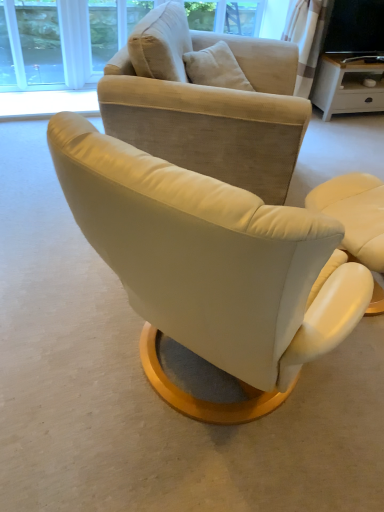
Question: Is matte black tv at upper right beside suede beige armchair at center, which ranks as the 3th chair in right-to-left order?

Choices:
 (A) yes
 (B) no

Answer: (B)

Question: From a real-world perspective, is matte black tv at upper right positioned over suede beige armchair at center, arranged as the first chair when viewed from the left, based on gravity?

Choices:
 (A) no
 (B) yes

Answer: (B)

Question: From the image's perspective, is matte black tv at upper right located above suede beige armchair at center, arranged as the first chair when viewed from the left?

Choices:
 (A) no
 (B) yes

Answer: (B)

Question: Does matte black tv at upper right have a lesser height compared to suede beige armchair at center, which ranks as the 3th chair in right-to-left order?

Choices:
 (A) no
 (B) yes

Answer: (B)

Question: From the image's perspective, would you say matte black tv at upper right is shown under suede beige armchair at center, which ranks as the 3th chair in right-to-left order?

Choices:
 (A) yes
 (B) no

Answer: (B)

Question: Would you say matte black tv at upper right is a long distance from suede beige armchair at center, arranged as the first chair when viewed from the left?

Choices:
 (A) no
 (B) yes

Answer: (B)

Question: Does leather armchair at center, the second chair when ordered from left to right, have a lesser height compared to matte white desk at upper right?

Choices:
 (A) yes
 (B) no

Answer: (A)

Question: Can you see leather armchair at center, the second chair when ordered from left to right, touching matte white desk at upper right?

Choices:
 (A) yes
 (B) no

Answer: (B)

Question: Does leather armchair at center, the second chair when ordered from left to right, come behind matte white desk at upper right?

Choices:
 (A) no
 (B) yes

Answer: (A)

Question: Can you confirm if leather armchair at center, the second chair when ordered from left to right, is thinner than matte white desk at upper right?

Choices:
 (A) yes
 (B) no

Answer: (B)

Question: Does leather armchair at center, the second chair when ordered from left to right, appear on the left side of matte white desk at upper right?

Choices:
 (A) no
 (B) yes

Answer: (B)

Question: Considering the relative positions of leather armchair at center, the second chair when ordered from left to right, and matte white desk at upper right in the image provided, is leather armchair at center, the second chair when ordered from left to right, to the right of matte white desk at upper right from the viewer's perspective?

Choices:
 (A) no
 (B) yes

Answer: (A)

Question: Considering the relative sizes of matte white desk at upper right and suede beige armchair at center, arranged as the first chair when viewed from the left, in the image provided, is matte white desk at upper right wider than suede beige armchair at center, arranged as the first chair when viewed from the left,?

Choices:
 (A) no
 (B) yes

Answer: (A)